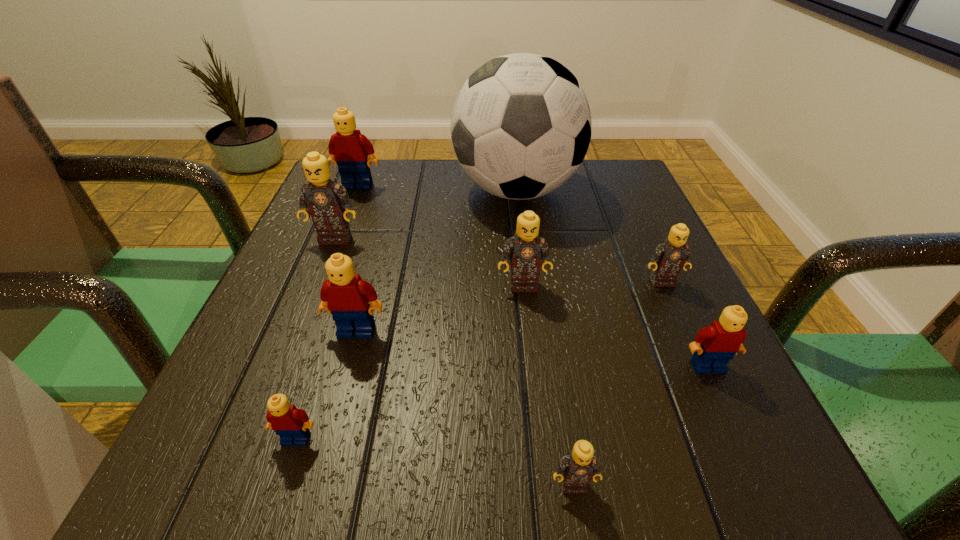
Locate which yellow Lego is the closest to the rightmost yellow Lego. Please provide its 2D coordinates. Your answer should be formatted as a tuple, i.e. [(x, y)], where the tuple contains the x and y coordinates of a point satisfying the conditions above.

[(345, 295)]

Locate which tan Lego is the fourth closest to the black soccer ball. Please provide its 2D coordinates. Your answer should be formatted as a tuple, i.e. [(x, y)], where the tuple contains the x and y coordinates of a point satisfying the conditions above.

[(579, 466)]

This screenshot has height=540, width=960. What are the coordinates of `tan Lego that is the third nearest to the third farthest yellow Lego` in the screenshot? It's located at (525, 250).

Where is `blank area in the image that satisfies the following two spatial constraints: 1. on the main logo of the soccer ball; 2. in front of the second biggest tan Lego`? The height and width of the screenshot is (540, 960). blank area in the image that satisfies the following two spatial constraints: 1. on the main logo of the soccer ball; 2. in front of the second biggest tan Lego is located at coordinates (527, 285).